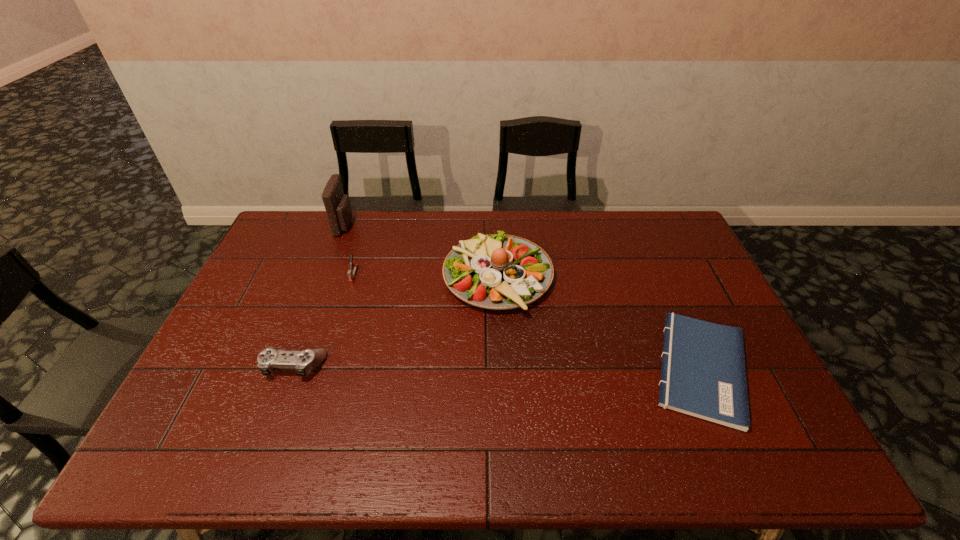
Where is `vacant space located on the handle side of the stapler`? The height and width of the screenshot is (540, 960). vacant space located on the handle side of the stapler is located at coordinates (341, 316).

The height and width of the screenshot is (540, 960). In order to click on vacant space located on the left of the second shortest object in this screenshot , I will do `click(204, 366)`.

Where is `free space located 0.240m on the left of the shortest object`? free space located 0.240m on the left of the shortest object is located at coordinates (555, 368).

Identify the location of pouch located in the far edge section of the desktop. Image resolution: width=960 pixels, height=540 pixels. (337, 205).

Where is `salad plate located in the far edge section of the desktop`? salad plate located in the far edge section of the desktop is located at coordinates (494, 271).

Locate an element on the screen. object at the near edge is located at coordinates (703, 374).

At what (x,y) coordinates should I click in order to perform the action: click on object that is positioned at the left edge. Please return your answer as a coordinate pair (x, y). The width and height of the screenshot is (960, 540). Looking at the image, I should click on (304, 361).

The image size is (960, 540). I want to click on object at the right edge, so click(703, 374).

Locate an element on the screen. The width and height of the screenshot is (960, 540). object located at the near right corner is located at coordinates (703, 374).

You are a GUI agent. You are given a task and a screenshot of the screen. Output one action in this format:
    pyautogui.click(x=<x>, y=<y>)
    Task: Click on the free spot at the far edge of the desktop
    This screenshot has width=960, height=540.
    Given the screenshot: What is the action you would take?
    pyautogui.click(x=564, y=247)